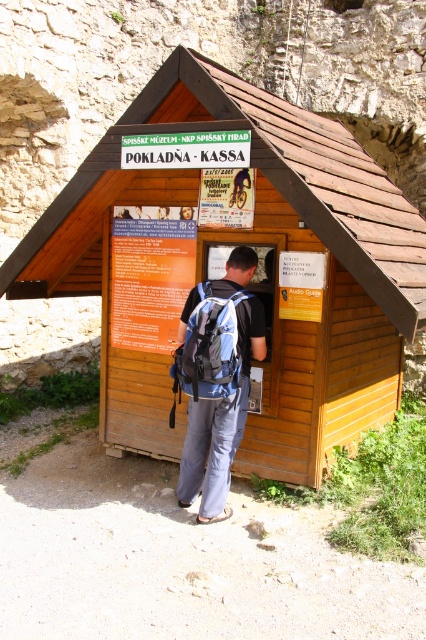
Question: Considering the relative positions of wooden cabin at center and blue backpack at center in the image provided, where is wooden cabin at center located with respect to blue backpack at center?

Choices:
 (A) right
 (B) left

Answer: (A)

Question: Which of the following is the closest to the observer?

Choices:
 (A) blue backpack at center
 (B) blue fabric backpack at center

Answer: (B)

Question: Among these points, which one is nearest to the camera?

Choices:
 (A) (218, 360)
 (B) (66, 225)
 (C) (215, 458)

Answer: (A)

Question: Is wooden cabin at center further to the viewer compared to blue backpack at center?

Choices:
 (A) no
 (B) yes

Answer: (A)

Question: Among these objects, which one is nearest to the camera?

Choices:
 (A) blue fabric backpack at center
 (B) wooden cabin at center

Answer: (B)

Question: Can you confirm if wooden cabin at center is positioned above blue fabric backpack at center?

Choices:
 (A) yes
 (B) no

Answer: (A)